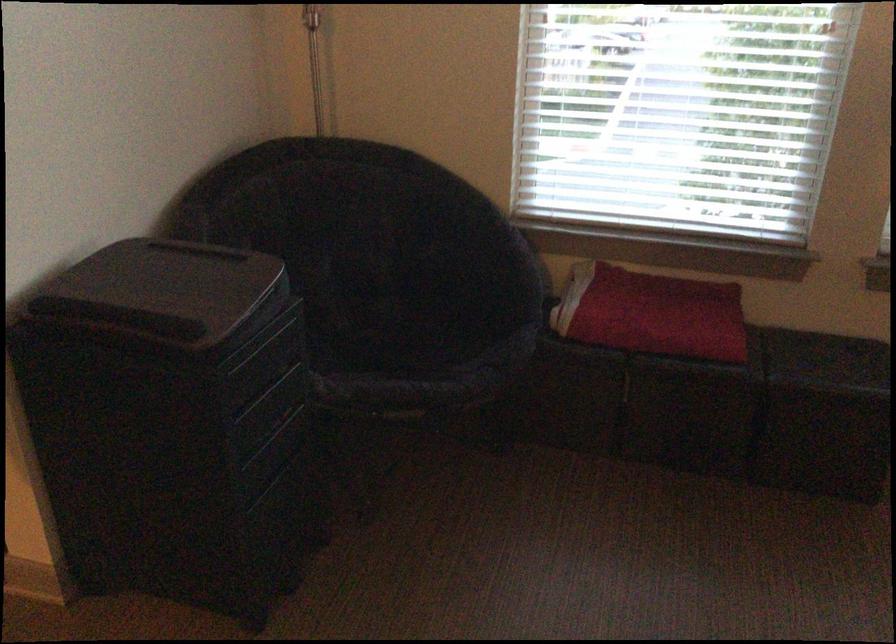
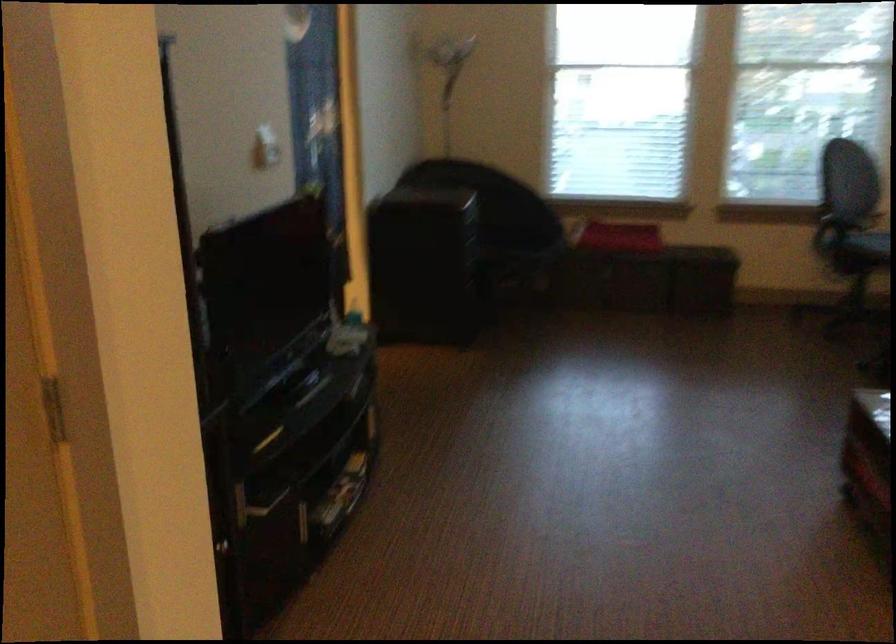
What movement of the cameraman would produce the second image?

The cameraman walked toward left, backward.